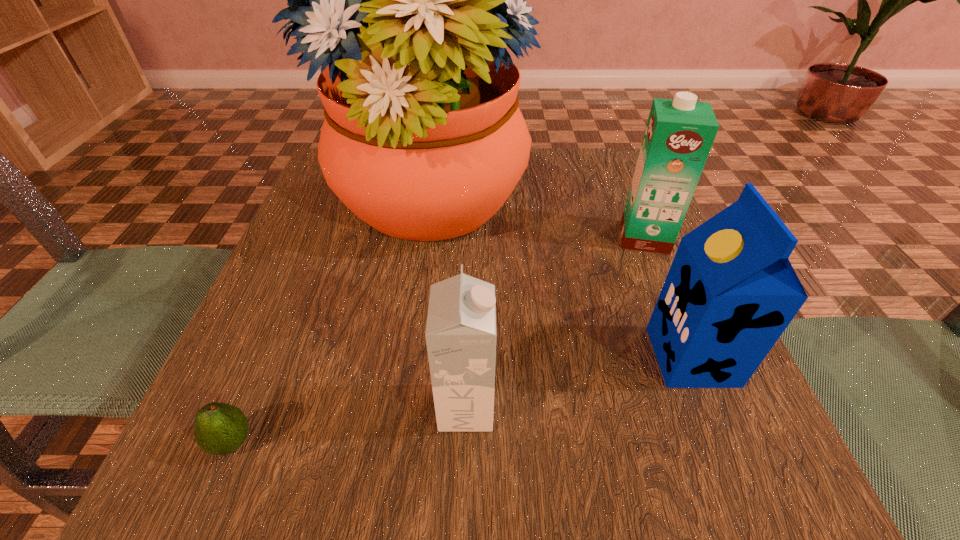
Where is `free space at the near right corner of the desktop`? This screenshot has width=960, height=540. free space at the near right corner of the desktop is located at coordinates (737, 488).

Locate an element on the screen. The image size is (960, 540). free spot between the shortest object and the leftmost carton is located at coordinates (349, 425).

The width and height of the screenshot is (960, 540). In order to click on vacant area between the leftmost carton and the shortest object in this screenshot , I will do `click(349, 425)`.

Where is `unoccupied position between the farthest carton and the tallest object`? unoccupied position between the farthest carton and the tallest object is located at coordinates (535, 221).

Where is `free space that is in between the tallest object and the avocado`? The width and height of the screenshot is (960, 540). free space that is in between the tallest object and the avocado is located at coordinates (328, 324).

Choose which object is the second nearest neighbor to the shortest object. Please provide its 2D coordinates. Your answer should be formatted as a tuple, i.e. [(x, y)], where the tuple contains the x and y coordinates of a point satisfying the conditions above.

[(408, 0)]

Locate which object is the second closest to the farthest carton. Please provide its 2D coordinates. Your answer should be formatted as a tuple, i.e. [(x, y)], where the tuple contains the x and y coordinates of a point satisfying the conditions above.

[(731, 291)]

Point out which carton is positioned as the nearest to the farthest carton. Please provide its 2D coordinates. Your answer should be formatted as a tuple, i.e. [(x, y)], where the tuple contains the x and y coordinates of a point satisfying the conditions above.

[(731, 291)]

You are a GUI agent. You are given a task and a screenshot of the screen. Output one action in this format:
    pyautogui.click(x=<x>, y=<y>)
    Task: Click on the second closest carton to the farthest carton
    The image size is (960, 540).
    Given the screenshot: What is the action you would take?
    pyautogui.click(x=460, y=334)

The width and height of the screenshot is (960, 540). I want to click on vacant space that satisfies the following two spatial constraints: 1. on the front label of the leftmost carton; 2. on the front side of the avocado, so click(x=465, y=443).